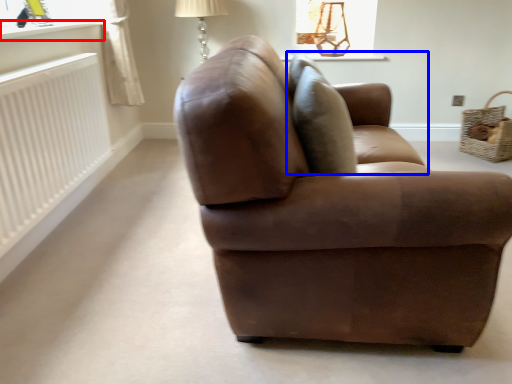
Question: Among these objects, which one is farthest to the camera, window sill (highlighted by a red box) or swivel chair (highlighted by a blue box)?

Choices:
 (A) window sill
 (B) swivel chair

Answer: (A)